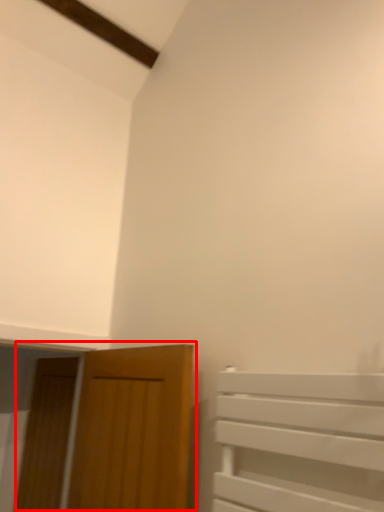
Question: From the image's perspective, where is door (annotated by the red box) located in relation to door in the image?

Choices:
 (A) above
 (B) below

Answer: (A)